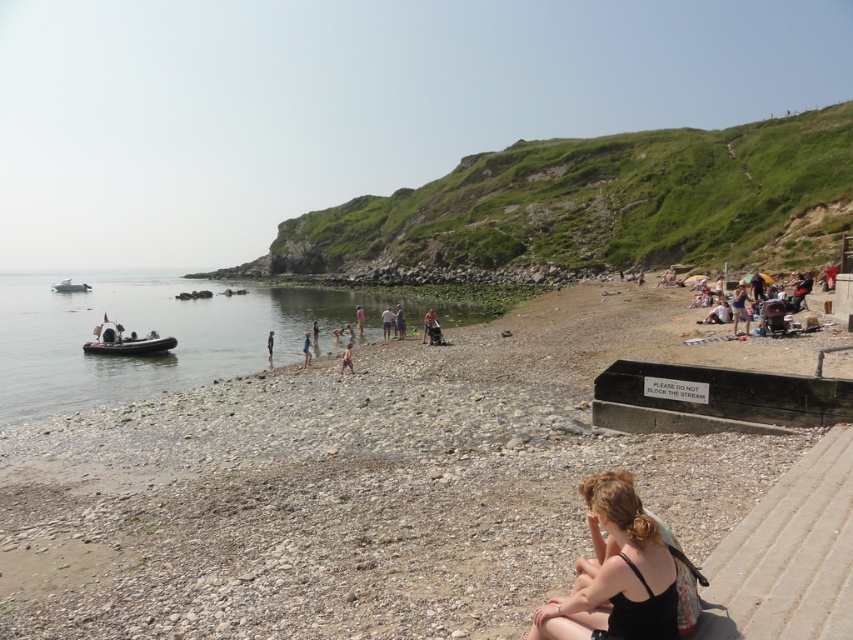
You are a visitor at the beach and want to take a photo of both the point at coordinates (x=86, y=340) and the point at coordinates (x=308, y=348). To ensure both points are in the frame, which point should you position closer to the camera?

To ensure both points are in the frame, you should position the point at coordinates (x=308, y=348) closer to the camera since it is in front of the point at coordinates (x=86, y=340).

You are a photographer standing at the camera position. You want to take a photo of both the point at coordinates point (625,500) and point (270,356). Since you can only focus on one point clearly, which point should you focus on to ensure the other point is still somewhat in focus?

You should focus on point (625,500) because it is closer to the camera than point (270,356). By focusing on the closer point, the farther point will still be within the depth of field and somewhat in focus.

You are a visitor at the beach and want to take a photo of the white glossy boat at left and the dark blue wetsuit at lower center. Which object should you adjust your camera focus on first to ensure both are in the frame?

The white glossy boat at left is further to the viewer than the dark blue wetsuit at lower center, so you should focus on the white glossy boat at left first to ensure both are in the frame.